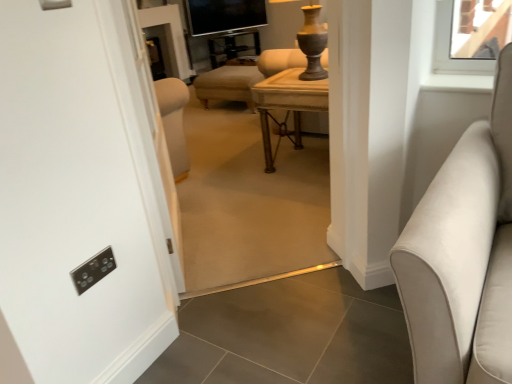
This screenshot has height=384, width=512. What do you see at coordinates (224, 15) in the screenshot?
I see `black glass tv at upper center` at bounding box center [224, 15].

What do you see at coordinates (288, 104) in the screenshot? I see `wooden table at center` at bounding box center [288, 104].

What are the coordinates of `black glass tv at upper center` in the screenshot? It's located at (224, 15).

Which is behind, point (229, 118) or point (283, 130)?

The point (229, 118) is farther.

Is matte beige ottoman at center turned away from wooden table at center?

That's not correct — matte beige ottoman at center is not looking away from wooden table at center.

Is there a large distance between matte beige ottoman at center and wooden table at center?

Actually, matte beige ottoman at center and wooden table at center are a little close together.

How many degrees apart are the facing directions of matte beige ottoman at center and wooden table at center?

The angular difference between matte beige ottoman at center and wooden table at center is 45.8 degrees.

Is point (266, 21) farther from viewer compared to point (227, 44)?

No, (266, 21) is closer to viewer.

Is black glass tv at upper center surrounding metallic gold side table at center?

No, metallic gold side table at center is not surrounded by black glass tv at upper center.

Is there a large distance between black glass tv at upper center and metallic gold side table at center?

No, there isn't a large distance between black glass tv at upper center and metallic gold side table at center.

Is matte beige ottoman at center situated inside metallic gold side table at center or outside?

matte beige ottoman at center cannot be found inside metallic gold side table at center.

How different are the orientations of matte beige ottoman at center and metallic gold side table at center in degrees?

matte beige ottoman at center and metallic gold side table at center are facing 131 degrees away from each other.

The width and height of the screenshot is (512, 384). I want to click on plain below the metallic gold side table at center (from the image's perspective), so click(249, 203).

From the image's perspective, which is above, matte beige ottoman at center or metallic gold side table at center?

metallic gold side table at center.

Is suede-like beige sofa at right further to the viewer compared to black glass tv at upper center?

No, it is not.

Can you see suede-like beige sofa at right touching black glass tv at upper center?

There is a gap between suede-like beige sofa at right and black glass tv at upper center.

Can you confirm if suede-like beige sofa at right is positioned to the right of black glass tv at upper center?

Correct, you'll find suede-like beige sofa at right to the right of black glass tv at upper center.

From the image's perspective, is metallic gold side table at center beneath black glass tv at upper center?

Yes, from the image's perspective, metallic gold side table at center is below black glass tv at upper center.

Which of these two, metallic gold side table at center or black glass tv at upper center, is bigger?

metallic gold side table at center.

In the scene shown: Which of these two, metallic gold side table at center or black glass tv at upper center, stands shorter?

Standing shorter between the two is black glass tv at upper center.

I want to click on window screen above the metallic gold side table at center (from a real-world perspective), so click(224, 15).

Between black glass tv at upper center and wooden table at center, which one has less height?

With less height is black glass tv at upper center.

Does black glass tv at upper center contain wooden table at center?

No, black glass tv at upper center does not contain wooden table at center.

Locate an element on the screen. window screen behind the wooden table at center is located at coordinates (224, 15).

Between black glass tv at upper center and wooden table at center, which one has smaller size?

Smaller between the two is black glass tv at upper center.

Does point (229, 44) come farther from viewer compared to point (179, 191)?

Yes.

Considering the sizes of metallic gold side table at center and matte beige ottoman at center in the image, is metallic gold side table at center wider or thinner than matte beige ottoman at center?

Clearly, metallic gold side table at center has more width compared to matte beige ottoman at center.

Is metallic gold side table at center positioned beyond the bounds of matte beige ottoman at center?

Yes.

Which object is more forward, metallic gold side table at center or matte beige ottoman at center?

matte beige ottoman at center.

The image size is (512, 384). I want to click on table below the matte beige ottoman at center (from a real-world perspective), so click(288, 104).

Find the location of a particular element. side table on the right of black glass tv at upper center is located at coordinates (232, 45).

Which object lies further to the anchor point metallic gold side table at center, wooden table at center or black glass tv at upper center?

wooden table at center is positioned further to the anchor metallic gold side table at center.

In the scene shown: Considering their positions, is suede-like beige sofa at right positioned closer to black glass tv at upper center than metallic gold side table at center?

metallic gold side table at center lies closer to black glass tv at upper center than the other object.

Which object lies further to the anchor point suede-like beige sofa at right, metallic gold side table at center or matte beige ottoman at center?

Among the two, metallic gold side table at center is located further to suede-like beige sofa at right.

Looking at the image, which one is located closer to matte beige ottoman at center, metallic gold side table at center or suede-like beige sofa at right?

suede-like beige sofa at right is closer to matte beige ottoman at center.

Looking at this image, when comparing their distances from wooden table at center, does suede-like beige sofa at right or matte beige ottoman at center seem further?

Based on the image, suede-like beige sofa at right appears to be further to wooden table at center.

Looking at this image, estimate the real-world distances between objects in this image. Which object is closer to black glass tv at upper center, suede-like beige sofa at right or matte beige ottoman at center?

The object closer to black glass tv at upper center is matte beige ottoman at center.

Estimate the real-world distances between objects in this image. Which object is closer to metallic gold side table at center, suede-like beige sofa at right or wooden table at center?

wooden table at center is positioned closer to the anchor metallic gold side table at center.

From the image, which object appears to be farther from suede-like beige sofa at right, wooden table at center or matte beige ottoman at center?

wooden table at center.

I want to click on table between suede-like beige sofa at right and metallic gold side table at center in the front-back direction, so click(x=288, y=104).

The width and height of the screenshot is (512, 384). I want to click on plain positioned between suede-like beige sofa at right and metallic gold side table at center from near to far, so click(249, 203).

Find the location of a particular element. table between matte beige ottoman at center and metallic gold side table at center along the z-axis is located at coordinates (288, 104).

I want to click on table between matte beige ottoman at center and black glass tv at upper center from front to back, so click(288, 104).